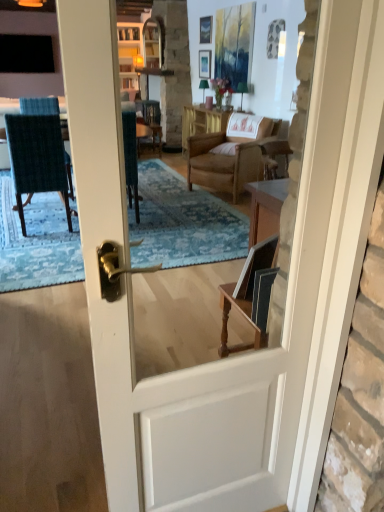
Question: Can you confirm if black glass window at upper left is shorter than wooden table at center?

Choices:
 (A) yes
 (B) no

Answer: (A)

Question: Can you confirm if black glass window at upper left is smaller than wooden table at center?

Choices:
 (A) yes
 (B) no

Answer: (A)

Question: Is black glass window at upper left facing towards wooden table at center?

Choices:
 (A) no
 (B) yes

Answer: (B)

Question: Does black glass window at upper left have a greater height compared to wooden table at center?

Choices:
 (A) yes
 (B) no

Answer: (B)

Question: Are black glass window at upper left and wooden table at center far apart?

Choices:
 (A) no
 (B) yes

Answer: (B)

Question: Is black glass window at upper left thinner than wooden table at center?

Choices:
 (A) yes
 (B) no

Answer: (A)

Question: Does matte white picture frame at upper center, the 1th picture frame ordered from the bottom, lie behind dark blue textured fabric chair at left?

Choices:
 (A) no
 (B) yes

Answer: (B)

Question: Is matte white picture frame at upper center, the 1th picture frame ordered from the bottom, wider than dark blue textured fabric chair at left?

Choices:
 (A) no
 (B) yes

Answer: (A)

Question: Can you confirm if matte white picture frame at upper center, the second picture frame in the top-to-bottom sequence, is smaller than dark blue textured fabric chair at left?

Choices:
 (A) yes
 (B) no

Answer: (A)

Question: Considering the relative sizes of matte white picture frame at upper center, the 1th picture frame ordered from the bottom, and dark blue textured fabric chair at left in the image provided, is matte white picture frame at upper center, the 1th picture frame ordered from the bottom, taller than dark blue textured fabric chair at left?

Choices:
 (A) yes
 (B) no

Answer: (B)

Question: Can you confirm if matte white picture frame at upper center, the second picture frame in the top-to-bottom sequence, is shorter than dark blue textured fabric chair at left?

Choices:
 (A) no
 (B) yes

Answer: (B)

Question: From a real-world perspective, is matte white picture frame at upper center, the 1th picture frame ordered from the bottom, over dark blue textured fabric chair at left?

Choices:
 (A) no
 (B) yes

Answer: (B)

Question: Is wooden table at center beside dark blue textured fabric chair at left?

Choices:
 (A) no
 (B) yes

Answer: (A)